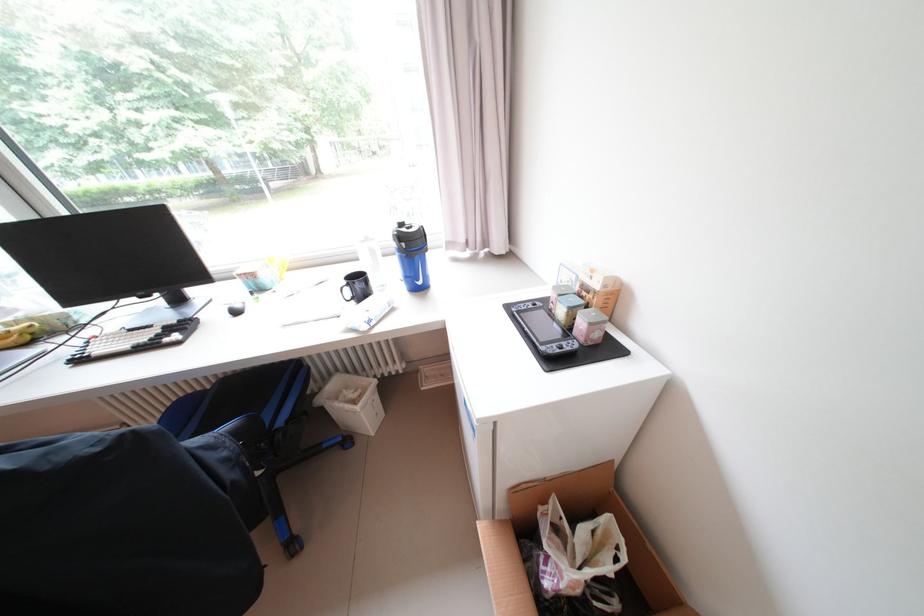
Find where to lift the nintendo switch console. Please return your answer as a coordinate pair (x, y).

(543, 329)